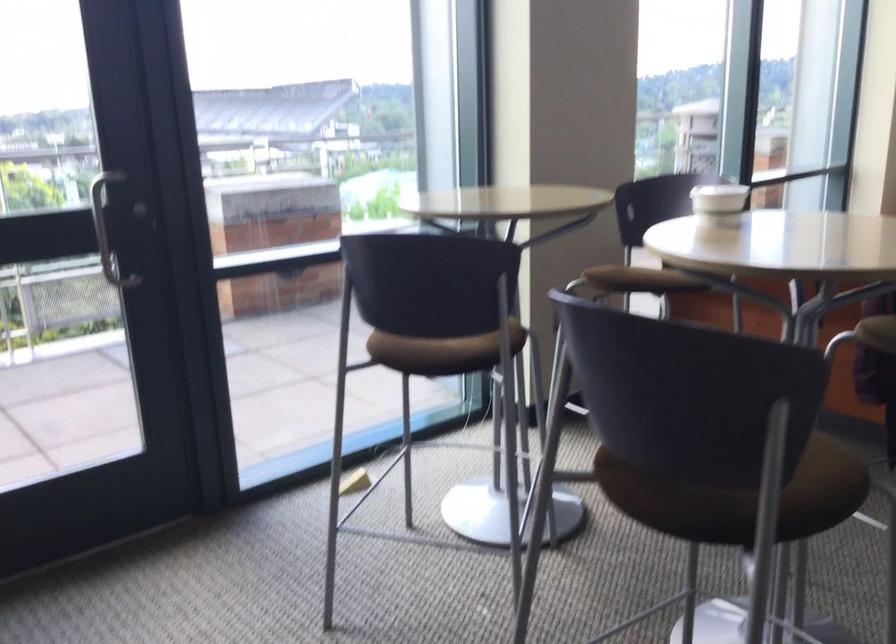
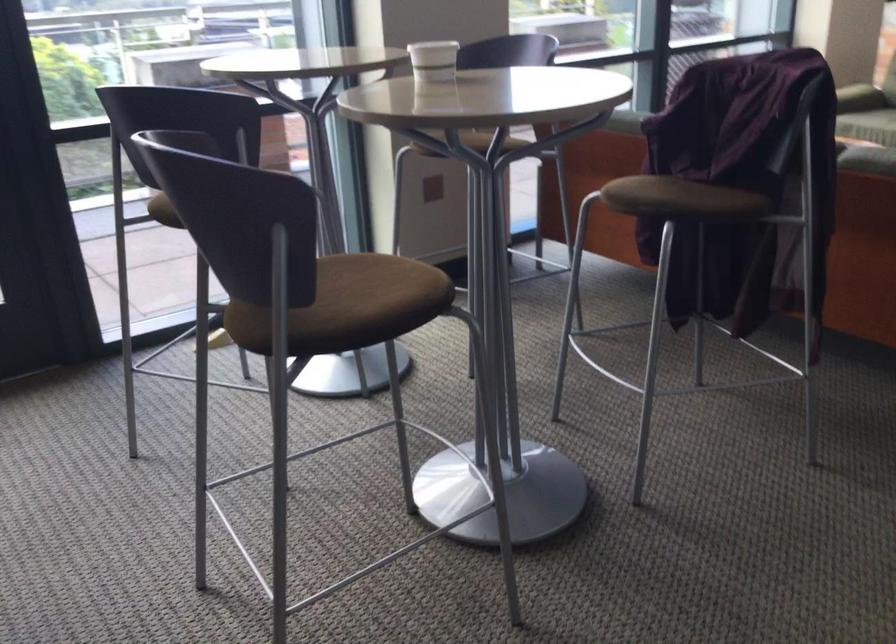
Find the pixel in the second image that matches point (384, 362) in the first image.

(162, 211)